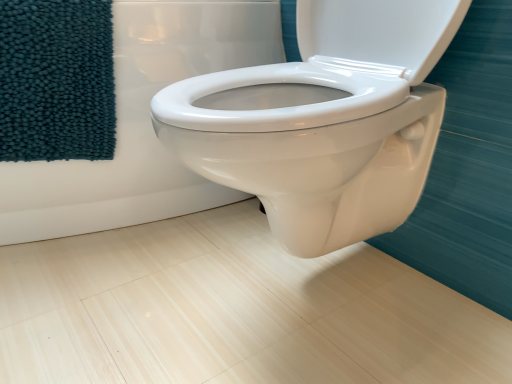
Question: From their relative heights in the image, would you say teal plush towel at left is taller or shorter than white glossy toilet at center?

Choices:
 (A) short
 (B) tall

Answer: (A)

Question: Considering their positions, is teal plush towel at left located in front of or behind white glossy toilet at center?

Choices:
 (A) behind
 (B) front

Answer: (A)

Question: In terms of size, does teal plush towel at left appear bigger or smaller than white glossy toilet at center?

Choices:
 (A) small
 (B) big

Answer: (A)

Question: Is point (174, 177) positioned closer to the camera than point (22, 114)?

Choices:
 (A) closer
 (B) farther

Answer: (B)

Question: From a real-world perspective, is white glossy toilet at center positioned above or below teal plush towel at left?

Choices:
 (A) below
 (B) above

Answer: (A)

Question: In the image, is white glossy toilet at center on the left side or the right side of teal plush towel at left?

Choices:
 (A) right
 (B) left

Answer: (A)

Question: Considering the positions of white glossy toilet at center and teal plush towel at left in the image, is white glossy toilet at center bigger or smaller than teal plush towel at left?

Choices:
 (A) big
 (B) small

Answer: (A)